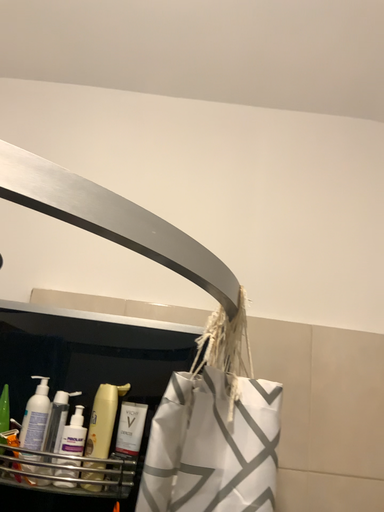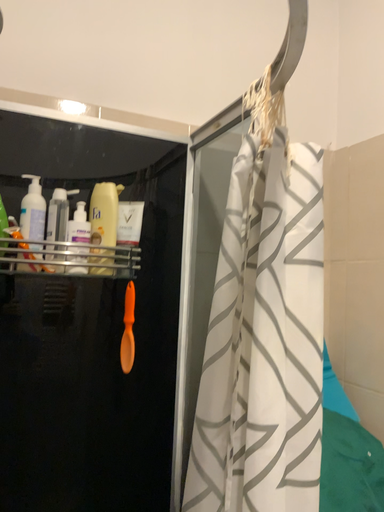
Question: Which way did the camera rotate in the video?

Choices:
 (A) rotated left
 (B) rotated right

Answer: (B)